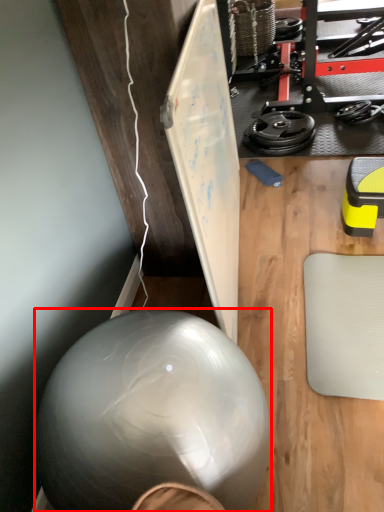
Question: From the image's perspective, considering the relative positions of ball (annotated by the red box) and wheel in the image provided, where is ball (annotated by the red box) located with respect to the staircase?

Choices:
 (A) below
 (B) above

Answer: (A)